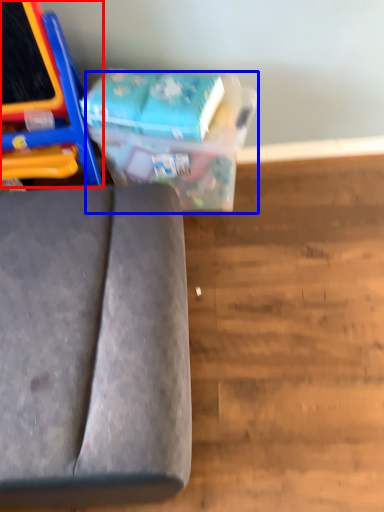
Question: Which object is closer to the camera taking this photo, furniture (highlighted by a red box) or cardboard box (highlighted by a blue box)?

Choices:
 (A) furniture
 (B) cardboard box

Answer: (A)